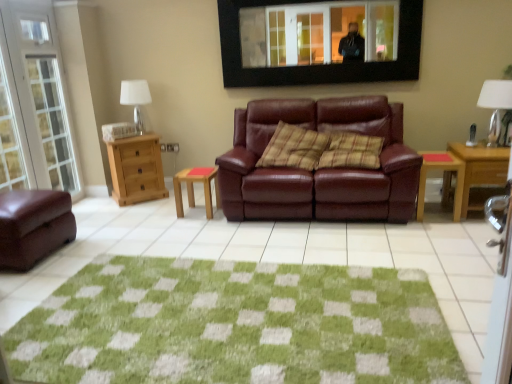
Identify the location of free spot below wooden stool at center, the second table from the right (from a real-world perspective). (198, 211).